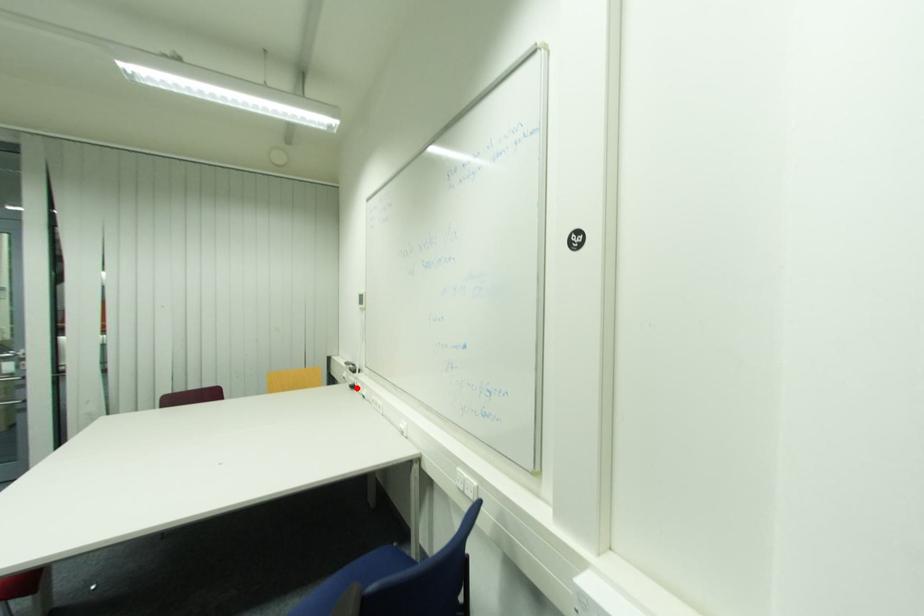
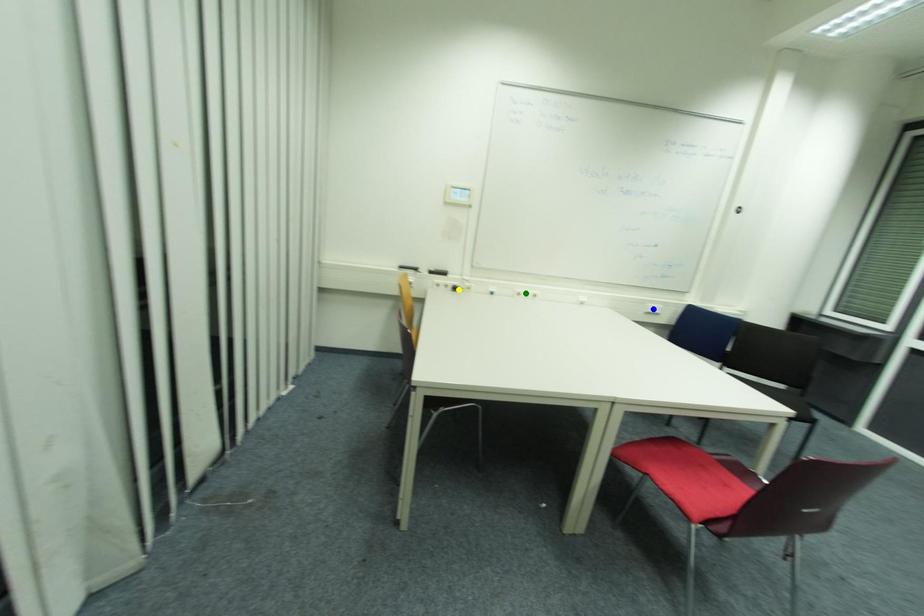
Question: I am providing you with two images of the same scene from different viewpoints. A red point is marked on the first image. You are given multiple points on the second image. Can you choose the point in image 2 that corresponds to the point in image 1?

Choices:
 (A) green point
 (B) blue point
 (C) yellow point

Answer: (C)